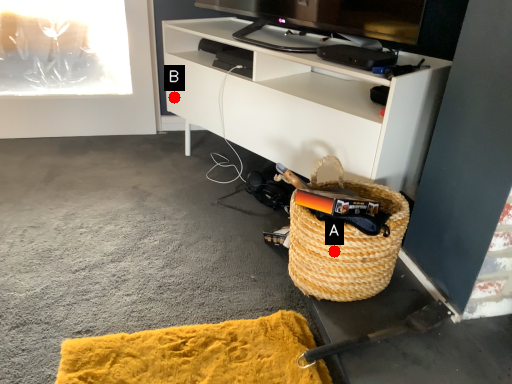
Question: Two points are circled on the image, labeled by A and B beside each circle. Which of the following is the farthest from the observer?

Choices:
 (A) A is further
 (B) B is further

Answer: (B)